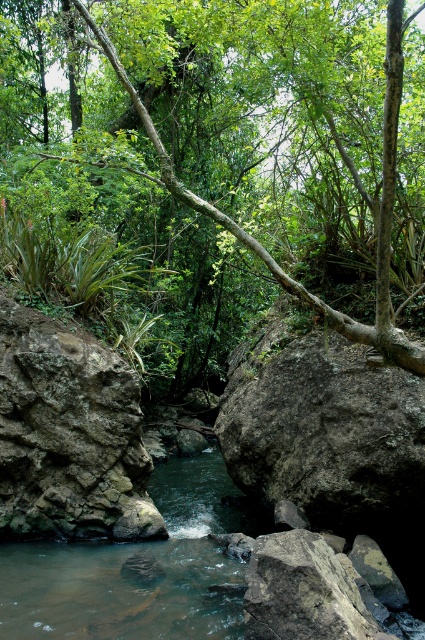
From the picture: You are a hiker trying to cross the stream. You see a green leafy tree at center and a rough textured rock at center. Which object is closer to your path if you are approaching from the left side of the stream?

The rough textured rock at center is closer to your path because the green leafy tree at center is positioned on the right side of it.

You are standing in the natural scene and want to take a photo of the green leafy tree at center. If your camera can focus on objects up to 3 meters away, will it be able to capture the tree clearly?

The green leafy tree at center is 2.69 meters away from the camera, which is within the camera focus range of up to 3 meters. Therefore, the camera can capture the tree clearly.

You are planning to take a photo of the green leafy tree at center and the rough textured rock at center. Which object should you focus on first if you want to capture both in the same frame without moving the camera?

You should focus on the green leafy tree at center first because it is larger in size than the rough textured rock at center, making it the more prominent subject to include in the frame.